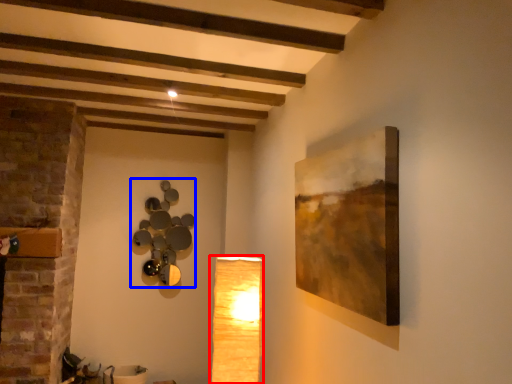
Question: Which of the following is the closest to the observer, lamp (highlighted by a red box) or lamp (highlighted by a blue box)?

Choices:
 (A) lamp
 (B) lamp

Answer: (A)